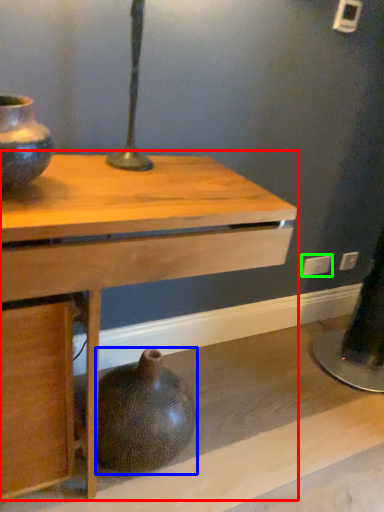
Question: Which object is the farthest from table (highlighted by a red box)? Choose among these: vase (highlighted by a blue box) or electric outlet (highlighted by a green box).

Choices:
 (A) vase
 (B) electric outlet

Answer: (B)